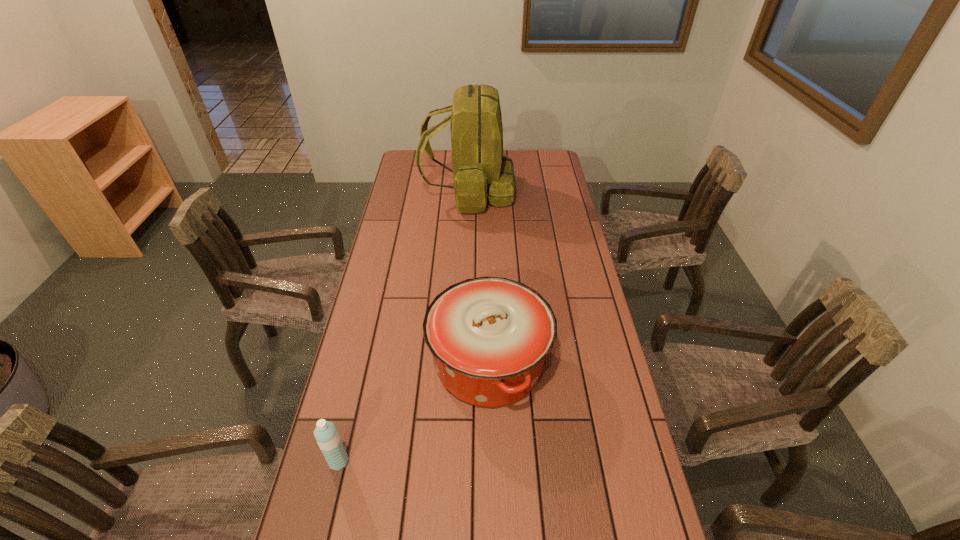
What are the coordinates of `backpack that is at the left edge` in the screenshot? It's located at (480, 171).

Image resolution: width=960 pixels, height=540 pixels. Find the location of `water bottle that is at the left edge`. water bottle that is at the left edge is located at coordinates (327, 437).

This screenshot has height=540, width=960. I want to click on object present at the far left corner, so click(480, 171).

Identify the location of blank space at the far edge of the desktop. This screenshot has height=540, width=960. (439, 152).

Image resolution: width=960 pixels, height=540 pixels. In the image, there is a desktop. In order to click on vacant space at the left edge in this screenshot , I will do `click(428, 197)`.

At what (x,y) coordinates should I click in order to perform the action: click on free space at the right edge of the desktop. Please return your answer as a coordinate pair (x, y). Looking at the image, I should click on (532, 209).

Where is `vacant region at the far left corner of the desktop`? Image resolution: width=960 pixels, height=540 pixels. vacant region at the far left corner of the desktop is located at coordinates (428, 158).

This screenshot has height=540, width=960. In order to click on vacant area at the far right corner of the desktop in this screenshot , I will do `click(527, 156)`.

The width and height of the screenshot is (960, 540). Find the location of `free area in between the second tallest object and the shortest object`. free area in between the second tallest object and the shortest object is located at coordinates (414, 413).

Find the location of a particular element. free spot between the nearest object and the tallest object is located at coordinates (403, 327).